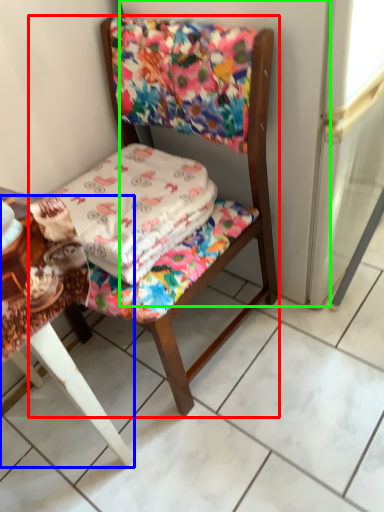
Question: Considering the real-world distances, which object is closest to chair (highlighted by a red box)? table (highlighted by a blue box) or screen door (highlighted by a green box).

Choices:
 (A) table
 (B) screen door

Answer: (B)